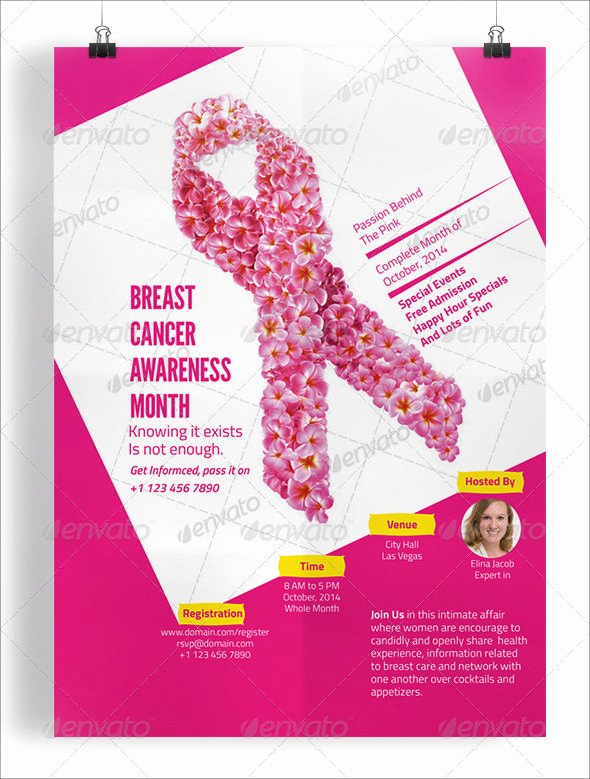
Where is `the left binder clip`? the left binder clip is located at coordinates (99, 48).